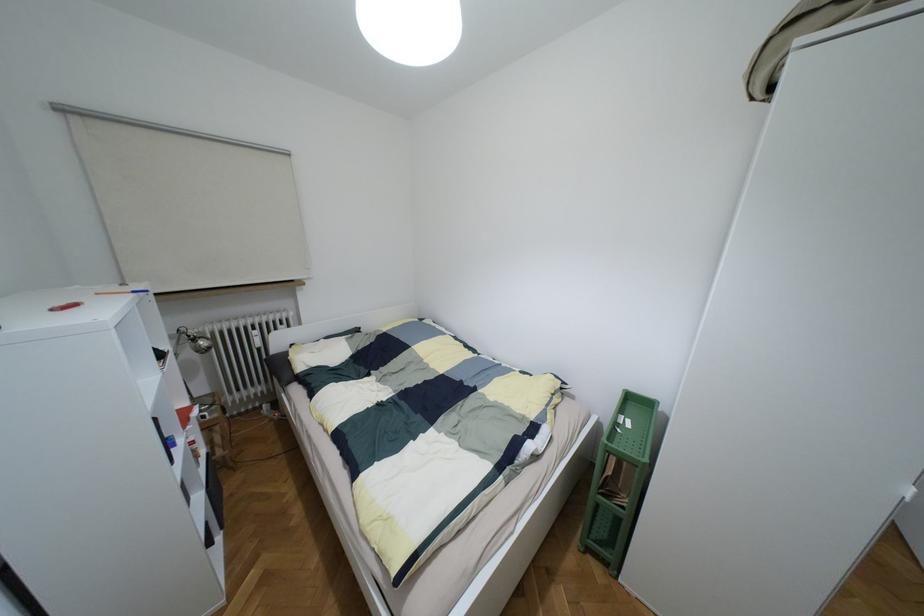
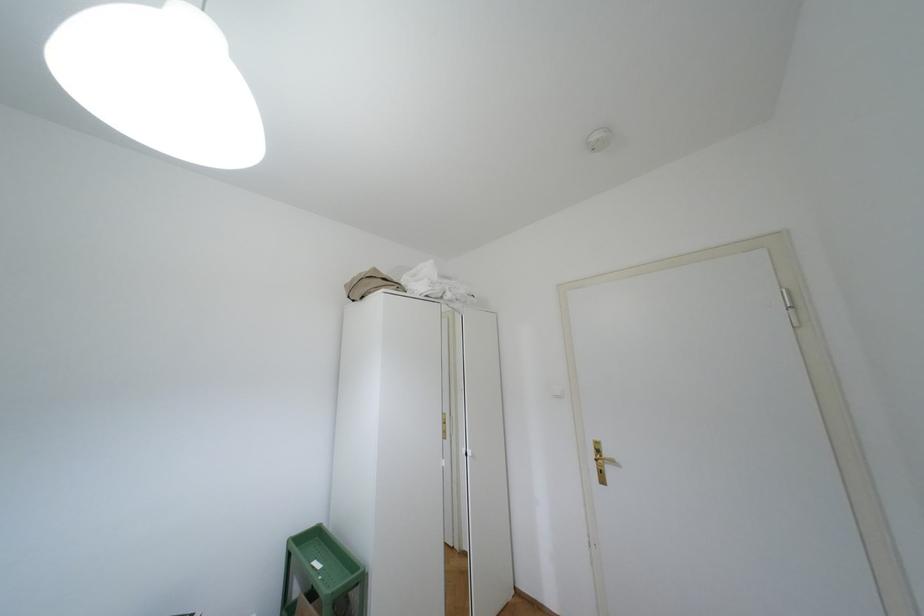
Question: The first image is from the beginning of the video and the second image is from the end. How did the camera likely rotate when shooting the video?

Choices:
 (A) Left
 (B) Right
 (C) Up
 (D) Down

Answer: (B)